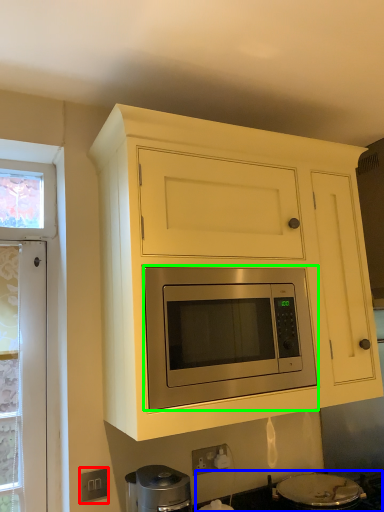
Question: Which is farther away from electric outlet (highlighted by a red box)? gas stove (highlighted by a blue box) or microwave oven (highlighted by a green box)?

Choices:
 (A) gas stove
 (B) microwave oven

Answer: (A)